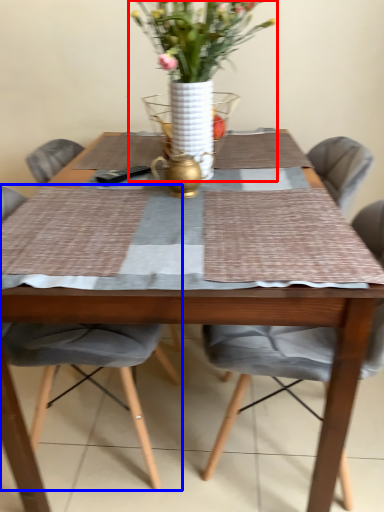
Question: Which object is closer to the camera taking this photo, houseplant (highlighted by a red box) or chair (highlighted by a blue box)?

Choices:
 (A) houseplant
 (B) chair

Answer: (A)